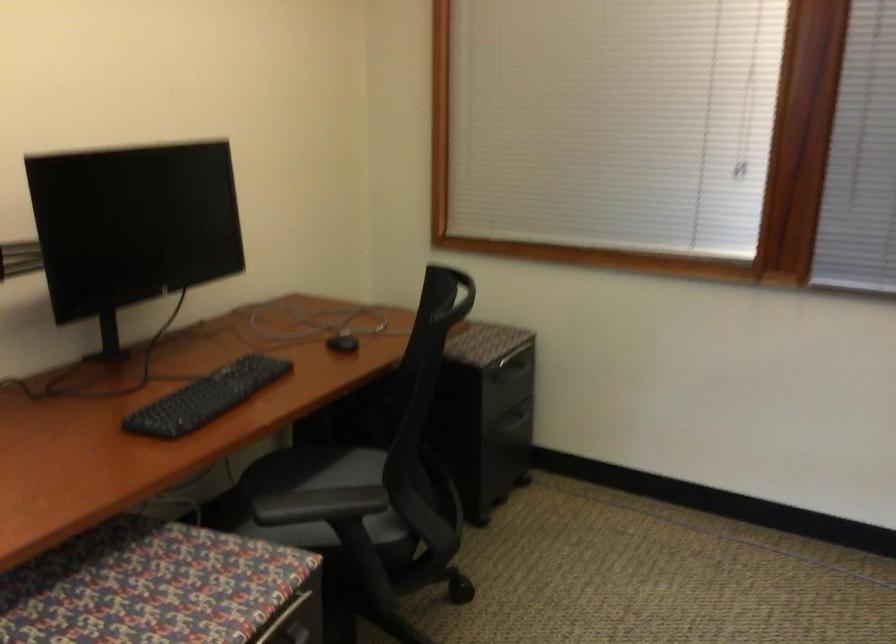
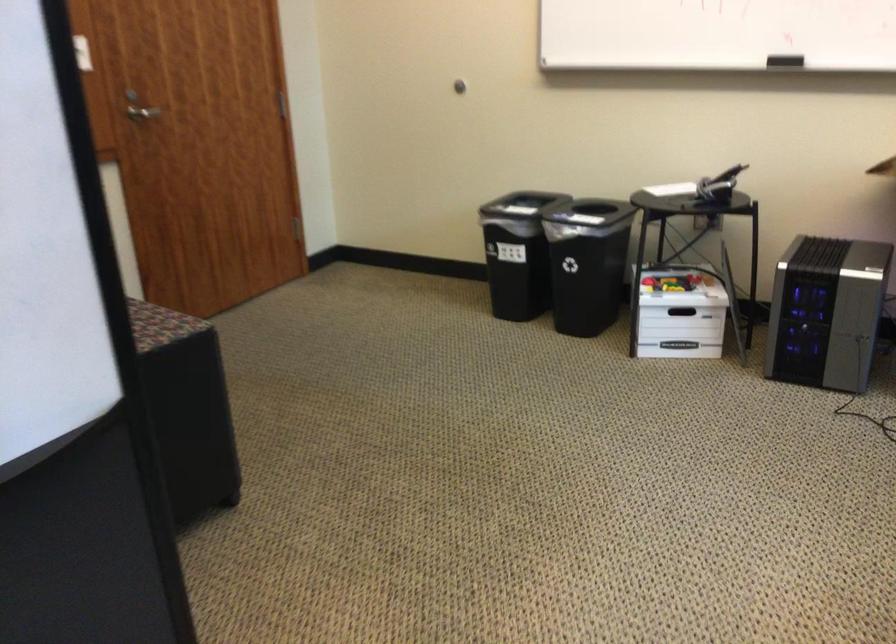
The images are taken continuously from a first-person perspective. In which direction is your viewpoint rotating?

The camera's rotation is toward right-down.